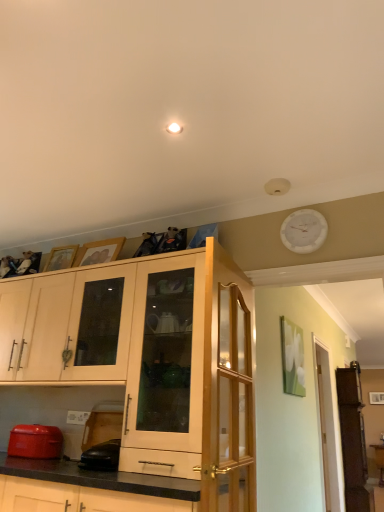
Question: Is matte wood cabinet at center, the 2th cabinetry positioned from the left, wider than white plastic clock at upper right?

Choices:
 (A) yes
 (B) no

Answer: (A)

Question: Is matte wood cabinet at center, acting as the 1th cabinetry starting from the right, positioned with its back to white plastic clock at upper right?

Choices:
 (A) yes
 (B) no

Answer: (B)

Question: Is the position of matte wood cabinet at center, the 2th cabinetry positioned from the left, more distant than that of white plastic clock at upper right?

Choices:
 (A) no
 (B) yes

Answer: (A)

Question: From the image's perspective, is matte wood cabinet at center, the 2th cabinetry positioned from the left, located beneath white plastic clock at upper right?

Choices:
 (A) yes
 (B) no

Answer: (A)

Question: Is matte wood cabinet at center, acting as the 1th cabinetry starting from the right, to the left of white plastic clock at upper right from the viewer's perspective?

Choices:
 (A) no
 (B) yes

Answer: (B)

Question: In terms of size, does matte wood cabinet at center, the 2th cabinetry positioned from the left, appear bigger or smaller than black rubber mouse at lower left, the 1th appliance positioned from the right?

Choices:
 (A) small
 (B) big

Answer: (B)

Question: Considering the positions of point (180, 366) and point (112, 423), is point (180, 366) closer or farther from the camera than point (112, 423)?

Choices:
 (A) closer
 (B) farther

Answer: (A)

Question: Based on their positions, is matte wood cabinet at center, the 2th cabinetry positioned from the left, located to the left or right of black rubber mouse at lower left, the 1th appliance positioned from the right?

Choices:
 (A) left
 (B) right

Answer: (B)

Question: In terms of height, does matte wood cabinet at center, the 2th cabinetry positioned from the left, look taller or shorter compared to black rubber mouse at lower left, the 1th appliance positioned from the right?

Choices:
 (A) short
 (B) tall

Answer: (B)

Question: Does point (291, 240) appear closer or farther from the camera than point (193, 351)?

Choices:
 (A) farther
 (B) closer

Answer: (A)

Question: In terms of width, does white plastic clock at upper right look wider or thinner when compared to matte wood cabinet at center, the 2th cabinetry positioned from the left?

Choices:
 (A) thin
 (B) wide

Answer: (A)

Question: Is white plastic clock at upper right to the left or to the right of matte wood cabinet at center, acting as the 1th cabinetry starting from the right, in the image?

Choices:
 (A) left
 (B) right

Answer: (B)

Question: From their relative heights in the image, would you say white plastic clock at upper right is taller or shorter than matte wood cabinet at center, the 2th cabinetry positioned from the left?

Choices:
 (A) tall
 (B) short

Answer: (B)

Question: Based on their sizes in the image, would you say clear glass door at right, positioned as the 1th glass door in right-to-left order, is bigger or smaller than black rubber mouse at lower left, the 1th appliance positioned from the right?

Choices:
 (A) big
 (B) small

Answer: (A)

Question: From a real-world perspective, is clear glass door at right, which ranks as the first glass door in back-to-front order, above or below black rubber mouse at lower left, the 1th appliance positioned from the right?

Choices:
 (A) below
 (B) above

Answer: (B)